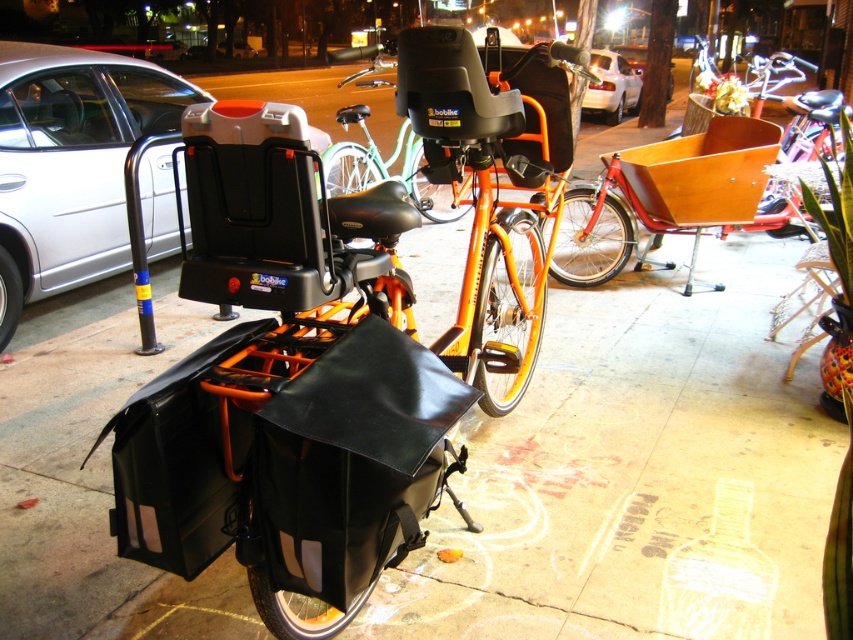
Which is above, matte black bike rack at left or wooden cart at center?

Positioned higher is matte black bike rack at left.

Who is more forward, (x=83, y=193) or (x=733, y=173)?

Positioned in front is point (x=83, y=193).

Image resolution: width=853 pixels, height=640 pixels. What are the coordinates of `matte black bike rack at left` in the screenshot? It's located at (70, 163).

Does wooden cart at center have a smaller size compared to orange matte bicycle at center?

No.

Between wooden cart at center and orange matte bicycle at center, which one is positioned lower?

wooden cart at center is below.

Is point (746, 198) positioned after point (376, 67)?

Yes, point (746, 198) is behind point (376, 67).

At what (x,y) coordinates should I click in order to perform the action: click on wooden cart at center. Please return your answer as a coordinate pair (x, y). Looking at the image, I should click on (666, 198).

Does point (56, 204) come closer to viewer compared to point (607, 86)?

Yes, it is in front of point (607, 86).

Can you confirm if matte black bike rack at left is positioned to the right of white glossy car at upper center?

No, matte black bike rack at left is not to the right of white glossy car at upper center.

Locate an element on the screen. matte black bike rack at left is located at coordinates (70, 163).